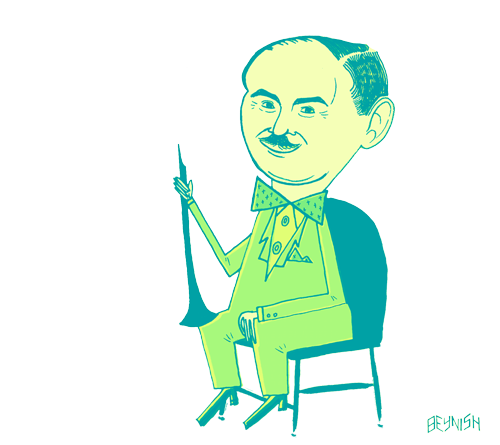
You are a GUI agent. You are given a task and a screenshot of the screen. Output one action in this format:
    pyautogui.click(x=<x>, y=<y>)
    Task: Click on the chair leg brace
    This screenshot has width=500, height=445.
    Given the screenshot: What is the action you would take?
    pyautogui.click(x=252, y=392), pyautogui.click(x=335, y=389)